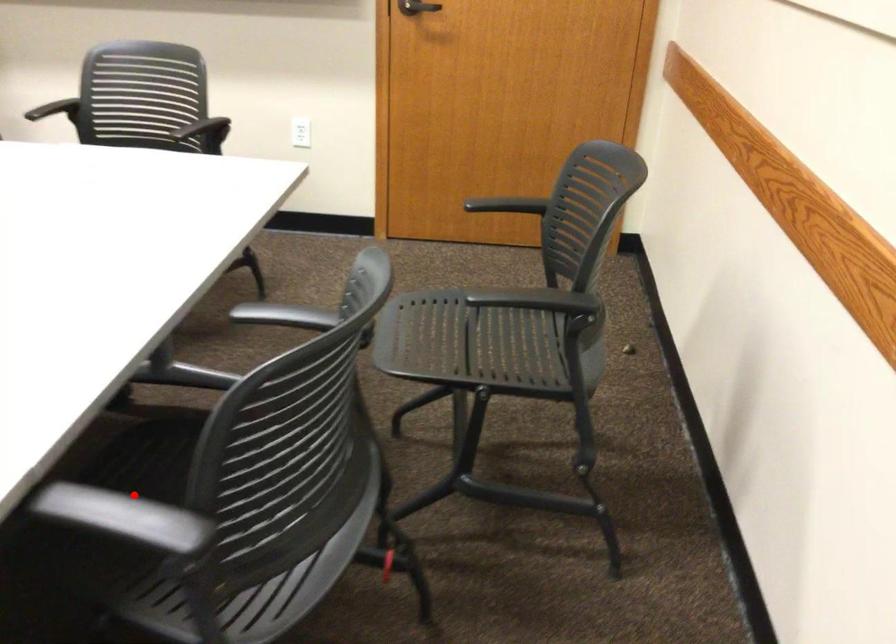
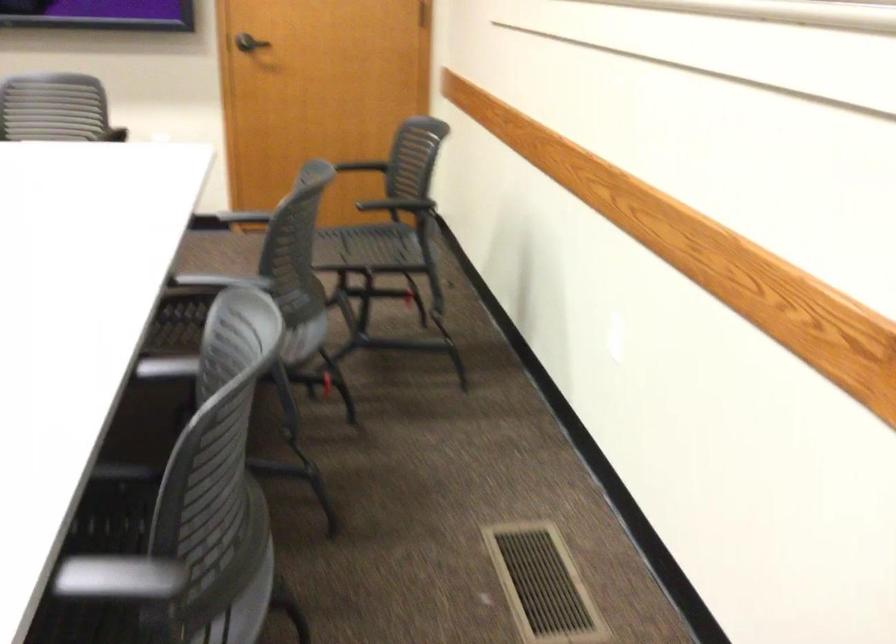
Question: I am providing you with two images of the same scene from different viewpoints. Given a red point in image1, look at the same physical point in image2. Is it:

Choices:
 (A) Closer to the viewpoint
 (B) Farther from the viewpoint

Answer: (B)